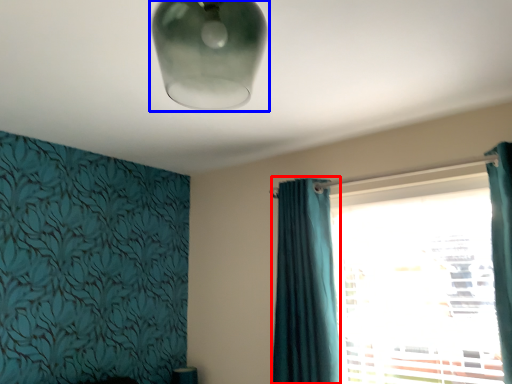
Question: Among these objects, which one is farthest to the camera, curtain (highlighted by a red box) or lamp (highlighted by a blue box)?

Choices:
 (A) curtain
 (B) lamp

Answer: (A)